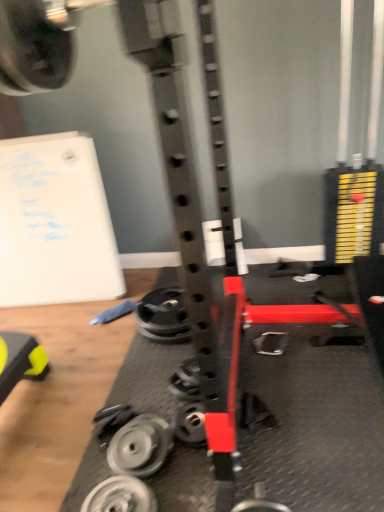
At what (x,y) coordinates should I click in order to perform the action: click on vacant area that lies to the right of silver metallic weight at center-left, which is the third wheel in back-to-front order. Please return your answer as a coordinate pair (x, y). Looking at the image, I should click on (185, 468).